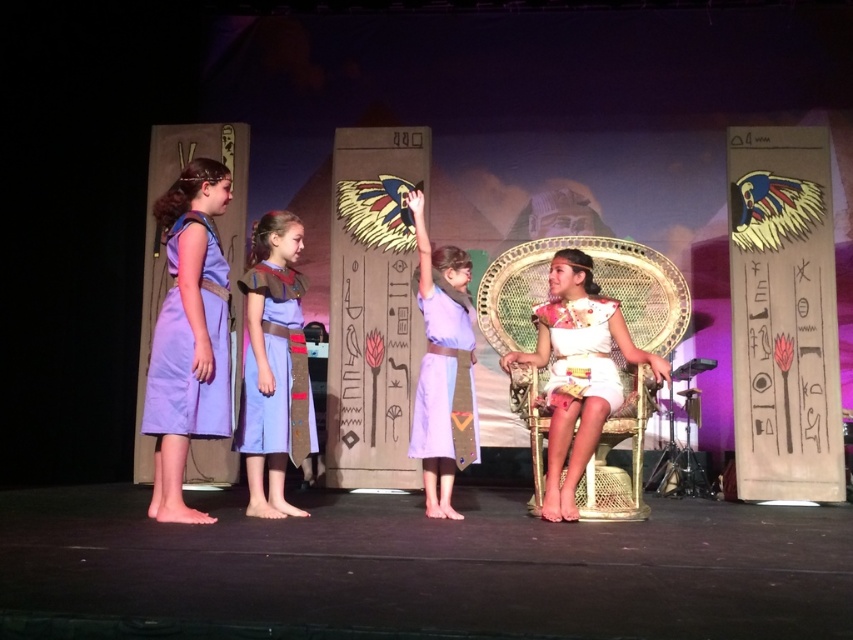
Between white fabric chair at center and matte purple dress at center, which one appears on the right side from the viewer's perspective?

Positioned to the right is white fabric chair at center.

Is white fabric chair at center in front of matte purple dress at center?

Yes.

Where is `white fabric chair at center`? white fabric chair at center is located at coordinates (577, 372).

Is the position of white fabric chair at center more distant than that of linen dress at center?

Yes, it is behind linen dress at center.

Is point (564, 346) positioned in front of point (300, 392)?

No, (564, 346) is behind (300, 392).

At what (x,y) coordinates should I click in order to perform the action: click on white fabric chair at center. Please return your answer as a coordinate pair (x, y). This screenshot has width=853, height=640. Looking at the image, I should click on (577, 372).

Is the position of lavender cotton dress at left less distant than that of white satin dress at center?

That is True.

Looking at this image, does lavender cotton dress at left have a lesser width compared to white satin dress at center?

Yes, lavender cotton dress at left is thinner than white satin dress at center.

Who is more distant from viewer, (164, 307) or (604, 324)?

The point (604, 324) is more distant.

Locate an element on the screen. This screenshot has width=853, height=640. lavender cotton dress at left is located at coordinates (190, 348).